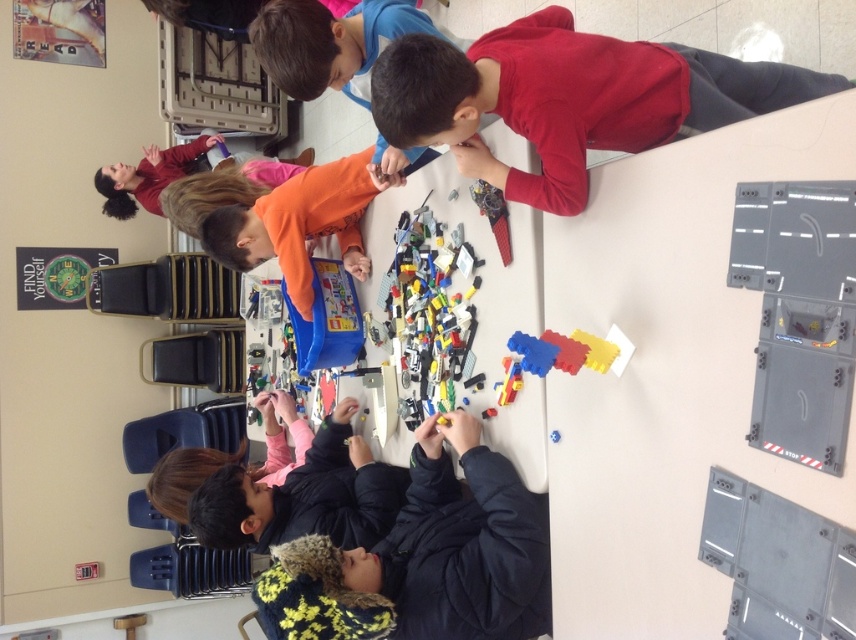
Between point (289, 627) and point (424, 307), which one is positioned in front?

Point (289, 627) is in front.

How distant is dark blue jacket at lower center from bright plastic lego pieces at center?

dark blue jacket at lower center is 14.05 inches away from bright plastic lego pieces at center.

Is point (522, 493) positioned after point (479, 388)?

That is False.

This screenshot has width=856, height=640. In order to click on dark blue jacket at lower center in this screenshot , I will do `click(425, 557)`.

Which is behind, point (488, 513) or point (435, 156)?

Point (435, 156)

Between dark blue jacket at lower center and orange matte shirt at upper center, which one appears on the left side from the viewer's perspective?

orange matte shirt at upper center

What are the coordinates of `dark blue jacket at lower center` in the screenshot? It's located at (425, 557).

Is point (397, 256) positioned in front of point (271, 29)?

No, (397, 256) is behind (271, 29).

Which of these two, bright plastic lego pieces at center or orange matte shirt at upper center, stands shorter?

Standing shorter between the two is orange matte shirt at upper center.

Who is more forward, (464, 307) or (266, 44)?

Positioned in front is point (266, 44).

The width and height of the screenshot is (856, 640). What are the coordinates of `bright plastic lego pieces at center` in the screenshot? It's located at (431, 312).